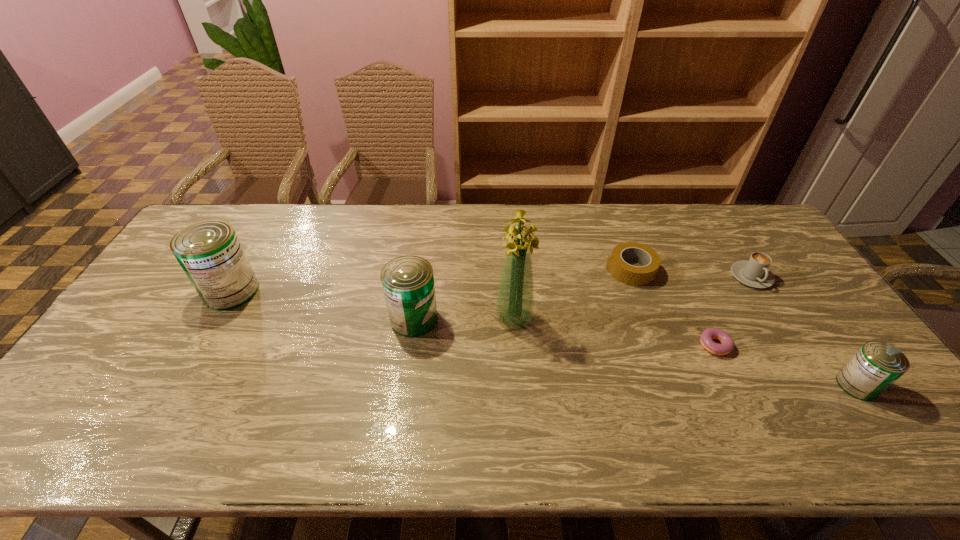
To make them evenly spaced by inserting another can among them, please locate a free space for this new can. Please provide its 2D coordinates. Your answer should be formatted as a tuple, i.e. [(x, y)], where the tuple contains the x and y coordinates of a point satisfying the conditions above.

[(620, 350)]